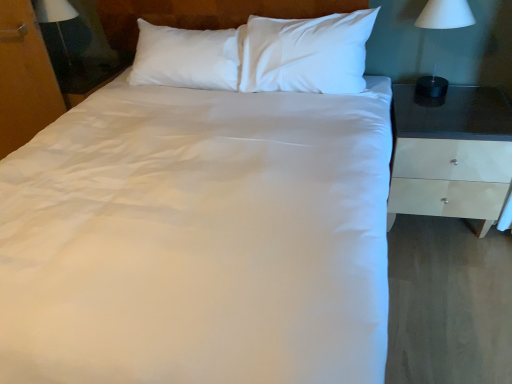
This screenshot has width=512, height=384. What are the coordinates of `vacant area on top of white glossy nightstand at right (from a real-world perspective)` in the screenshot? It's located at (432, 104).